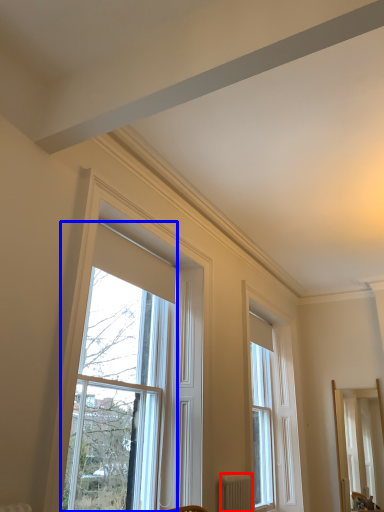
Question: Which object appears closest to the camera in this image, radiator (highlighted by a red box) or window (highlighted by a blue box)?

Choices:
 (A) radiator
 (B) window

Answer: (B)